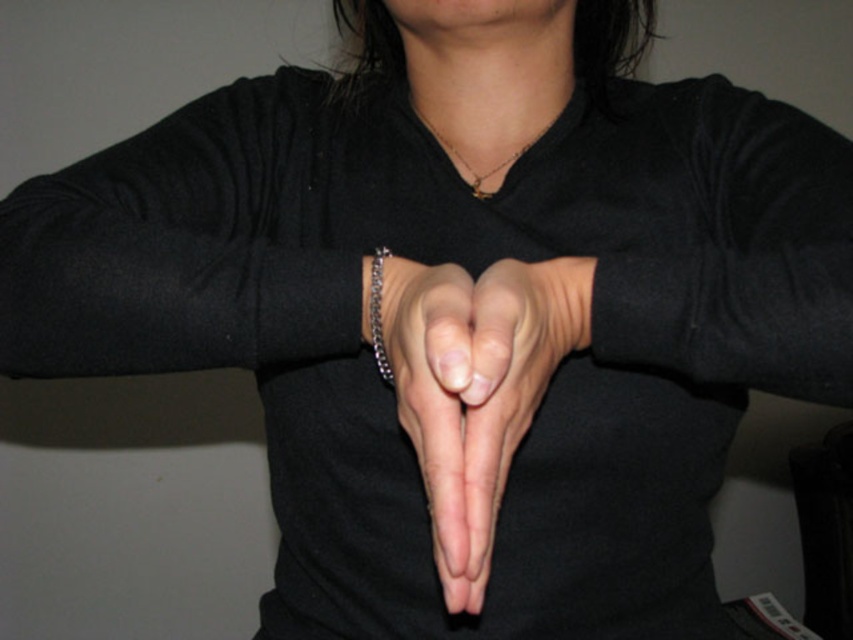
Is smooth skin at center wider than silver metallic bracelet at center?

Yes.

Looking at this image, is smooth skin at center behind silver metallic bracelet at center?

No.

Who is more forward, (401, 324) or (379, 374)?

Point (401, 324)

Identify the location of smooth skin at center. The image size is (853, 640). (439, 410).

Is smooth skin hand at center positioned before smooth skin at center?

No.

Which is behind, point (546, 372) or point (436, 344)?

Positioned behind is point (546, 372).

Image resolution: width=853 pixels, height=640 pixels. Describe the element at coordinates (506, 394) in the screenshot. I see `smooth skin hand at center` at that location.

The height and width of the screenshot is (640, 853). Identify the location of smooth skin hand at center. (506, 394).

Is smooth skin hand at center closer to the viewer compared to gold chain at center?

Yes, smooth skin hand at center is in front of gold chain at center.

Is smooth skin hand at center thinner than gold chain at center?

Yes, smooth skin hand at center is thinner than gold chain at center.

Identify the location of smooth skin hand at center. The height and width of the screenshot is (640, 853). (506, 394).